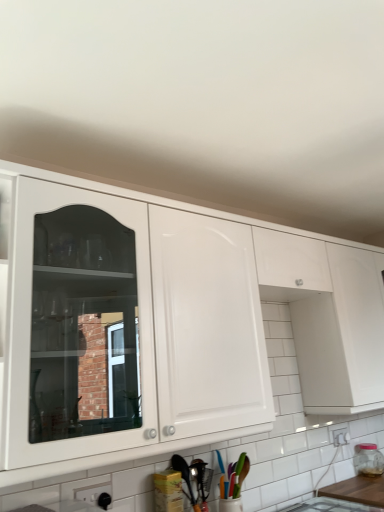
Question: Can you confirm if wooden at lower right is smaller than transparent glass jar at right?

Choices:
 (A) yes
 (B) no

Answer: (B)

Question: Is wooden at lower right wider than transparent glass jar at right?

Choices:
 (A) no
 (B) yes

Answer: (B)

Question: Can you confirm if wooden at lower right is bigger than transparent glass jar at right?

Choices:
 (A) no
 (B) yes

Answer: (B)

Question: Is wooden at lower right to the left of transparent glass jar at right from the viewer's perspective?

Choices:
 (A) no
 (B) yes

Answer: (B)

Question: Is wooden at lower right shorter than transparent glass jar at right?

Choices:
 (A) yes
 (B) no

Answer: (A)

Question: In terms of width, does transparent glass jar at right look wider or thinner when compared to wooden at lower right?

Choices:
 (A) thin
 (B) wide

Answer: (A)

Question: Based on their positions, is transparent glass jar at right located to the left or right of wooden at lower right?

Choices:
 (A) right
 (B) left

Answer: (A)

Question: Considering the positions of transparent glass jar at right and wooden at lower right in the image, is transparent glass jar at right taller or shorter than wooden at lower right?

Choices:
 (A) short
 (B) tall

Answer: (B)

Question: From the image's perspective, is transparent glass jar at right positioned above or below wooden at lower right?

Choices:
 (A) above
 (B) below

Answer: (A)

Question: In the image, is wooden at lower right positioned in front of or behind metallic silver spoon at lower center?

Choices:
 (A) behind
 (B) front

Answer: (A)

Question: Based on their positions, is wooden at lower right located to the left or right of metallic silver spoon at lower center?

Choices:
 (A) left
 (B) right

Answer: (B)

Question: From a real-world perspective, is wooden at lower right physically located above or below metallic silver spoon at lower center?

Choices:
 (A) below
 (B) above

Answer: (A)

Question: Considering the positions of wooden at lower right and metallic silver spoon at lower center in the image, is wooden at lower right bigger or smaller than metallic silver spoon at lower center?

Choices:
 (A) small
 (B) big

Answer: (B)

Question: Is white glossy cabinet at upper center wider or thinner than transparent glass jar at right?

Choices:
 (A) wide
 (B) thin

Answer: (A)

Question: Would you say white glossy cabinet at upper center is inside or outside transparent glass jar at right?

Choices:
 (A) outside
 (B) inside

Answer: (A)